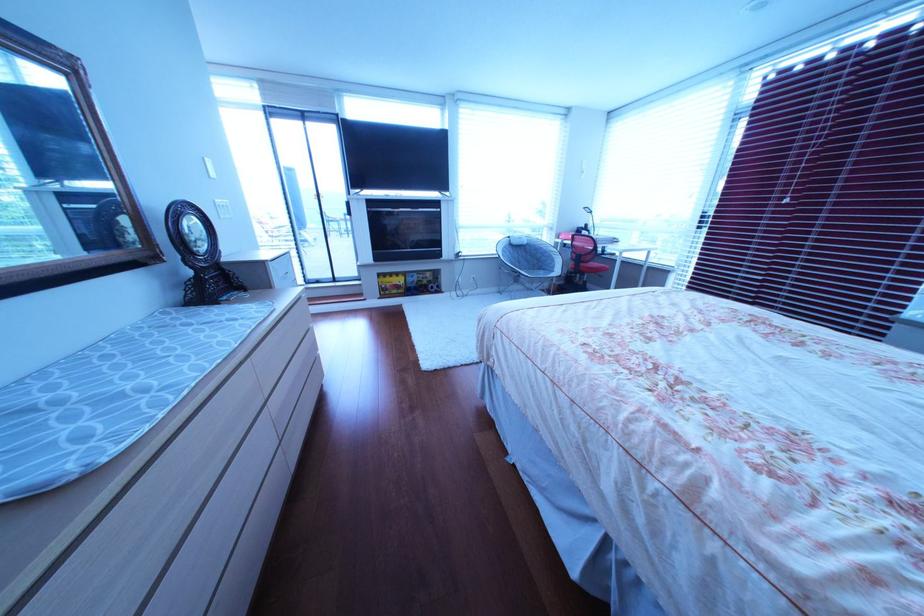
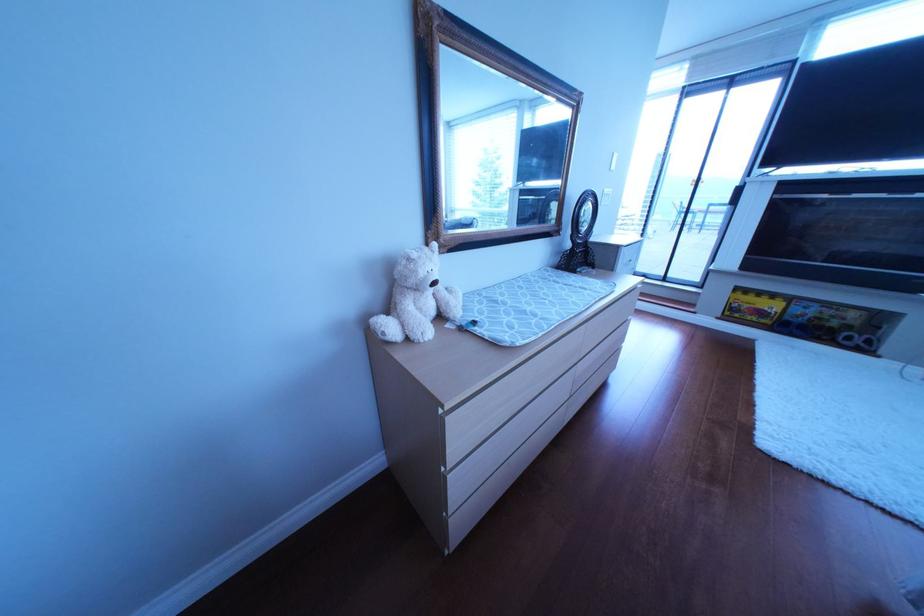
Where in the second image is the point corresponding to the point at 139,392 from the first image?

(541, 312)